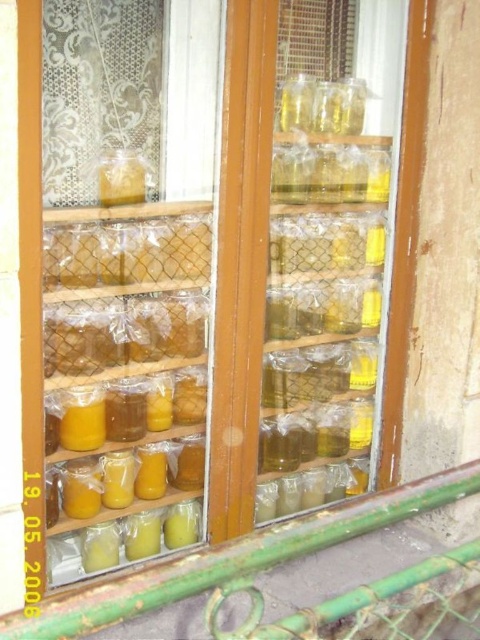
You are a delivery person who needs to place a new jar that is the same size as the translucent plastic jar at center onto the green metal rail at lower center. Can the rail accommodate the jar?

The green metal rail at lower center is wider than the translucent plastic jar at center, so yes, the rail can accommodate the new jar since its width is sufficient.

You are a delivery person trying to place a new jar that is 12 inches wide onto the green metal rail at lower center. Can the jar fit between the two closest objects on the rail?

The two closest objects on the green metal rail at lower center are 32.33 inches apart, so the 12 inch jar can fit between them.

You are standing in front of the window with shelves of jars. There is a point at coordinates (244, 556). Where is this point located in relation to the green metal rail at lower center?

The point at (244, 556) is located on the green metal rail at lower center.